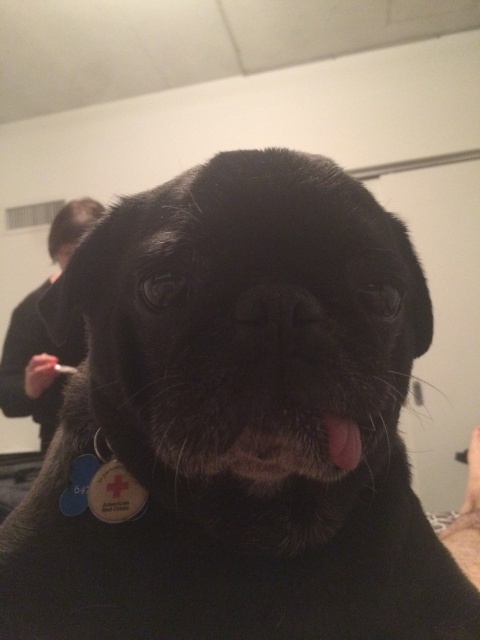
Question: Based on their relative distances, which object is farther from the black matte nose at center?

Choices:
 (A) pink fur at center
 (B) black fabric shirt at upper left

Answer: (B)

Question: Is black fabric shirt at upper left bigger than pink fur at center?

Choices:
 (A) no
 (B) yes

Answer: (B)

Question: Which object is the farthest from the black fabric shirt at upper left?

Choices:
 (A) pink fur at center
 (B) black matte nose at center

Answer: (B)

Question: Which object appears closest to the camera in this image?

Choices:
 (A) pink fur at center
 (B) black fabric shirt at upper left

Answer: (A)

Question: Does black fabric shirt at upper left come behind pink fur at center?

Choices:
 (A) yes
 (B) no

Answer: (A)

Question: Considering the relative positions of black fabric shirt at upper left and pink fur at center in the image provided, where is black fabric shirt at upper left located with respect to pink fur at center?

Choices:
 (A) above
 (B) below

Answer: (A)